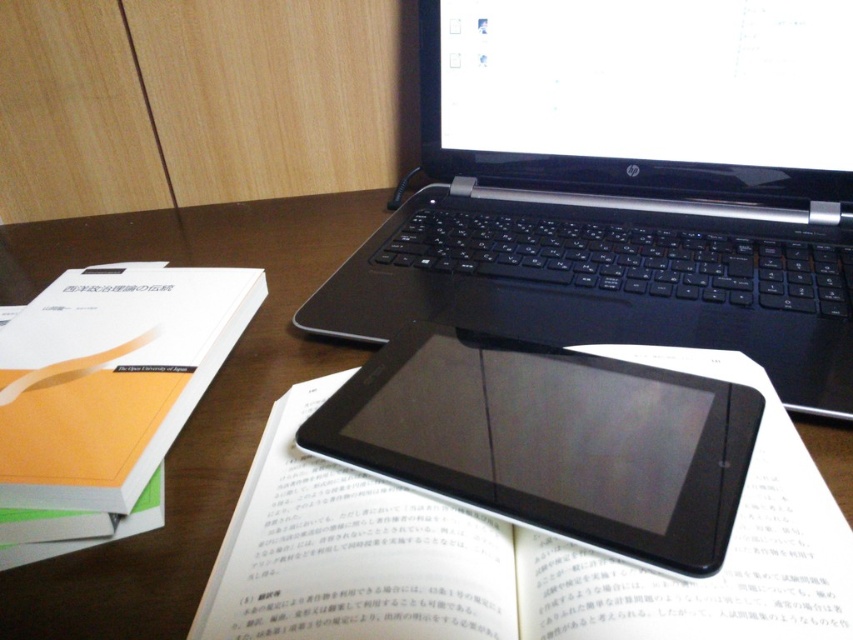
You are a photographer taking a picture of the workspace. You notice two points marked in the image at coordinates point [502,426] and point [62,584]. Which point should you focus on to ensure the closest object is in sharp focus?

Point [62,584] should be focused on because it is closer to the camera than point [502,426], ensuring the closest object is in sharp focus.

You have a small toy car that is 3 inches long. You want to place it between the black plastic tablet at center and the brown wooden table at center. Will it fit without overlapping either object?

The distance between the black plastic tablet at center and the brown wooden table at center is 9.46 inches. Since the toy car is only 3 inches long, it will fit comfortably between them without overlapping either object.